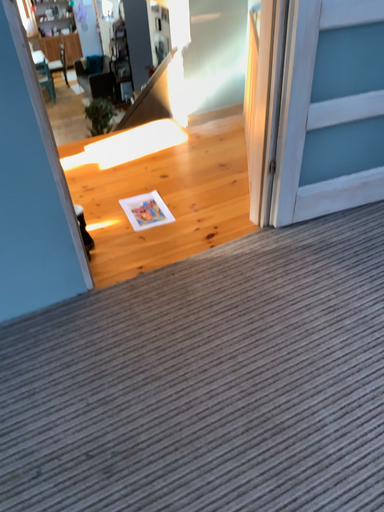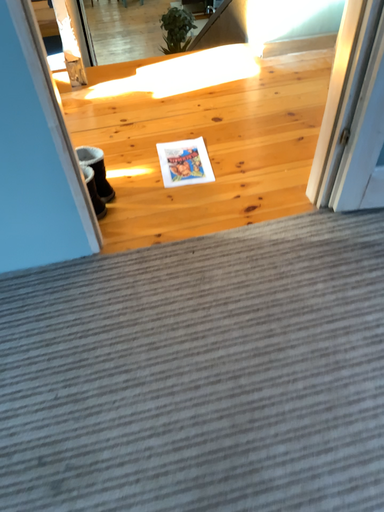
Question: Which way did the camera rotate in the video?

Choices:
 (A) rotated upward
 (B) rotated downward

Answer: (B)